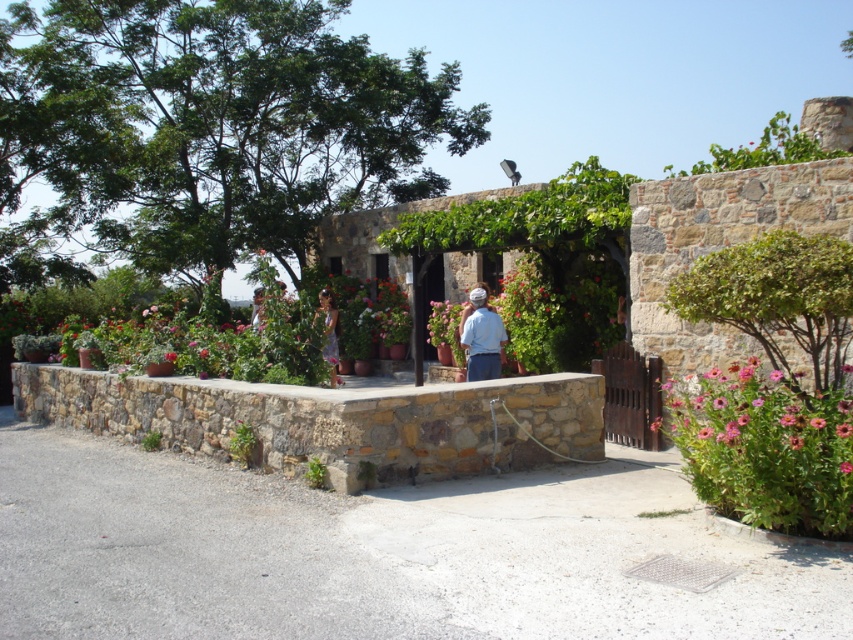
You are standing at the entrance of the garden and see the pink matte flower at lower right and the white cotton shirt at center. Which object is positioned more to the right side of the garden?

The pink matte flower at lower right is positioned more to the right side of the garden because it is to the right of the white cotton shirt at center.

You are standing in the courtyard and see the white cotton shirt at center. If you walk straight ahead, will you step on the shirt?

The white cotton shirt at center is located at point (480,337), which is in the central area of the courtyard. Since you are walking straight ahead, you will likely step on the shirt unless you change direction.